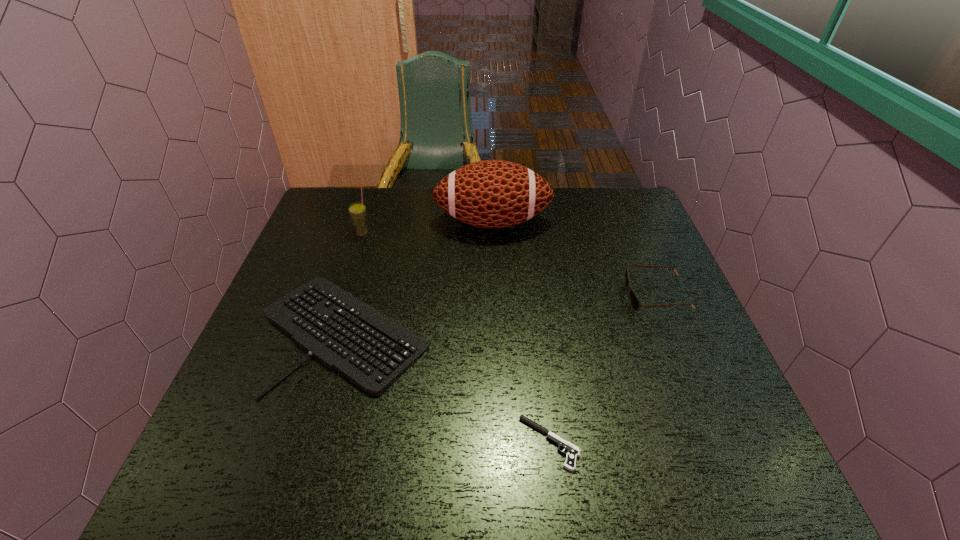
The height and width of the screenshot is (540, 960). In order to click on blank region between the fourth tallest object and the sunglasses in this screenshot , I will do `click(500, 314)`.

Locate an element on the screen. The image size is (960, 540). free space that is in between the second tallest object and the pistol is located at coordinates (456, 339).

Identify the location of free spot between the straw for drinking and the shortest object. (456, 339).

Image resolution: width=960 pixels, height=540 pixels. I want to click on empty location between the football and the pistol, so click(521, 333).

The image size is (960, 540). Identify the location of free point between the pistol and the tallest object. (521, 333).

Where is `free space between the tallest object and the third shortest object`? free space between the tallest object and the third shortest object is located at coordinates (574, 259).

Where is `free space between the computer keyboard and the shortest object`? The image size is (960, 540). free space between the computer keyboard and the shortest object is located at coordinates (447, 387).

Where is `vacant area that lies between the sunglasses and the tallest object`? vacant area that lies between the sunglasses and the tallest object is located at coordinates (574, 259).

Identify the location of free point between the sunglasses and the nearest object. The image size is (960, 540). (603, 369).

At what (x,y) coordinates should I click in order to perform the action: click on the second closest object relative to the fourth shortest object. Please return your answer as a coordinate pair (x, y). This screenshot has width=960, height=540. Looking at the image, I should click on (491, 193).